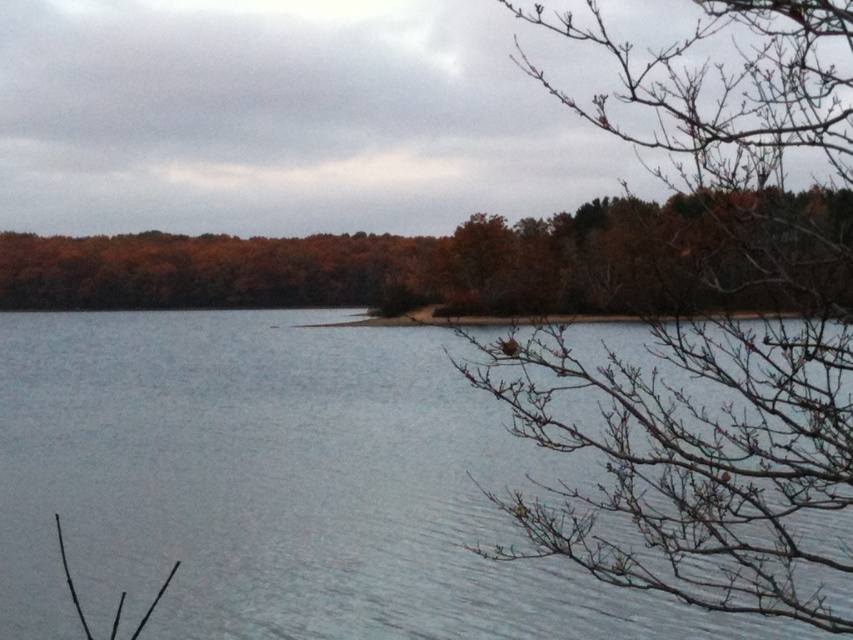
Question: Which point is farther to the camera?

Choices:
 (A) (645, 429)
 (B) (566, 220)

Answer: (B)

Question: Which of the following is the closest to the observer?

Choices:
 (A) brown matte tree at center
 (B) bare branches at upper right
 (C) clear water at center

Answer: (B)

Question: Is bare branches at upper right to the left of brown matte tree at center from the viewer's perspective?

Choices:
 (A) yes
 (B) no

Answer: (B)

Question: Is bare branches at upper right to the left of brown matte tree at center from the viewer's perspective?

Choices:
 (A) yes
 (B) no

Answer: (B)

Question: Which object is the closest to the bare branches at upper right?

Choices:
 (A) brown matte tree at center
 (B) clear water at center

Answer: (A)

Question: Considering the relative positions of clear water at center and bare branches at upper right in the image provided, where is clear water at center located with respect to bare branches at upper right?

Choices:
 (A) below
 (B) above

Answer: (A)